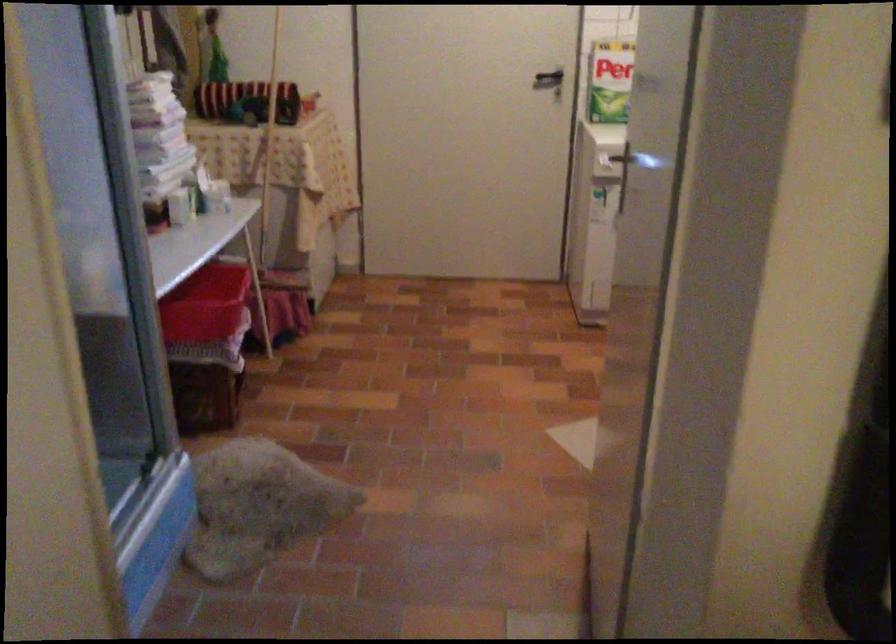
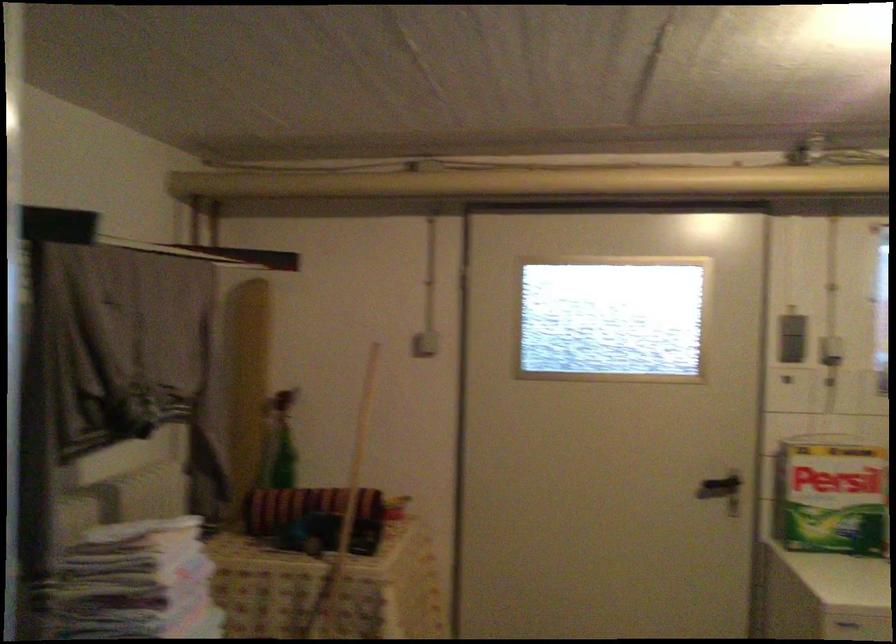
Question: The images are taken continuously from a first-person perspective. In which direction are you moving?

Choices:
 (A) Left
 (B) Right
 (C) Forward
 (D) Backward

Answer: (C)